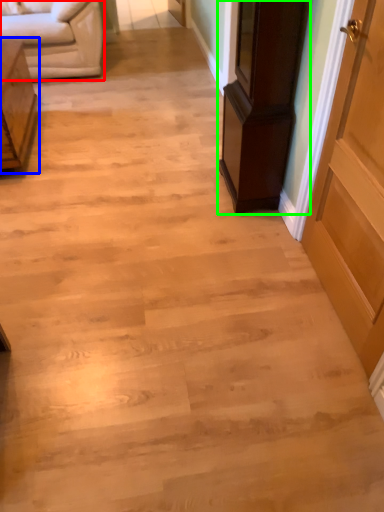
Question: Based on their relative distances, which object is farther from studio couch (highlighted by a red box)? Choose from furniture (highlighted by a blue box) and furniture (highlighted by a green box).

Choices:
 (A) furniture
 (B) furniture

Answer: (B)